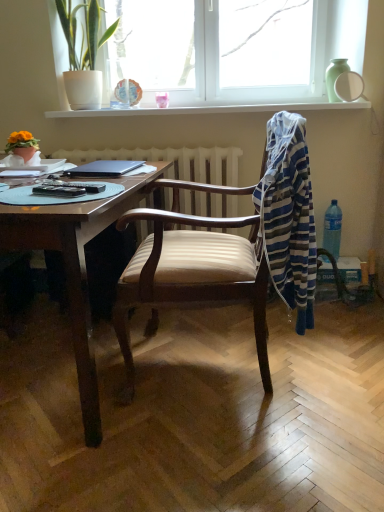
Question: Relative to white glass window at upper center, is wooden desk at center in front or behind?

Choices:
 (A) front
 (B) behind

Answer: (A)

Question: Considering the relative positions of wooden desk at center and white glass window at upper center in the image provided, is wooden desk at center to the left or to the right of white glass window at upper center?

Choices:
 (A) right
 (B) left

Answer: (B)

Question: Which object is positioned farthest from the white glossy shelf at upper center?

Choices:
 (A) striped fabric at right
 (B) wooden desk at center
 (C) matte orange flower pot at lower left, the first houseplant from the bottom
 (D) white glossy mirror at upper right
 (E) green leafy plant at upper left, placed as the 2th houseplant when sorted from left to right

Answer: (B)

Question: Which object is the farthest from the green leafy plant at upper left, the 2th houseplant from the bottom?

Choices:
 (A) wooden desk at center
 (B) matte orange flower pot at lower left, acting as the second houseplant starting from the right
 (C) black matte laptop at upper left
 (D) striped fabric at right
 (E) clear plastic bottle at right

Answer: (E)